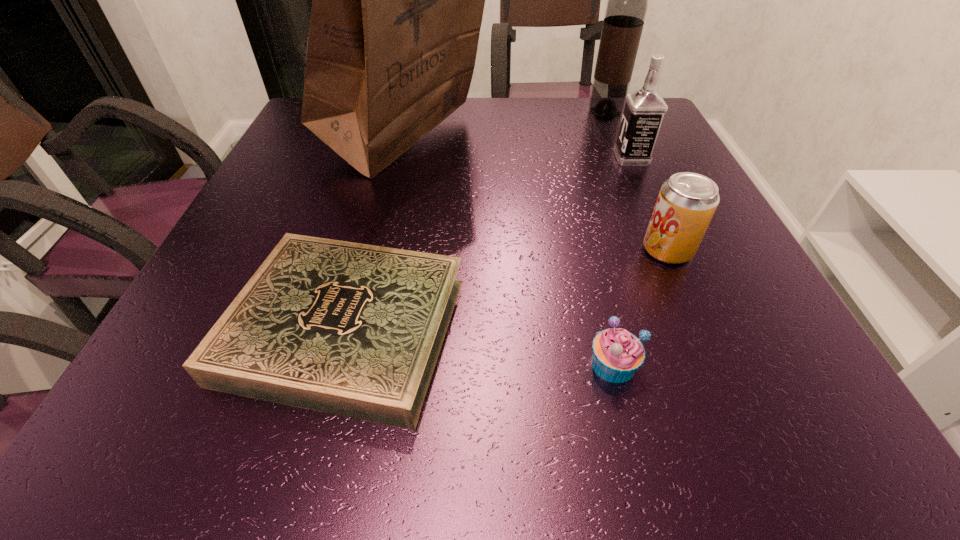
Where is `vacant space located on the front label of the vodka`? This screenshot has width=960, height=540. vacant space located on the front label of the vodka is located at coordinates (x=549, y=158).

Locate an element on the screen. free spot located 0.050m on the front label of the vodka is located at coordinates (595, 158).

I want to click on free point located on the left of the pop (soda), so click(x=537, y=250).

Where is `vacant space situated on the back of the third object from left to right`? vacant space situated on the back of the third object from left to right is located at coordinates (571, 192).

I want to click on vacant space located on the right of the hardback book, so click(x=656, y=329).

The image size is (960, 540). In order to click on grocery bag that is at the far edge in this screenshot , I will do `click(397, 0)`.

Where is `wine bottle present at the far edge`? wine bottle present at the far edge is located at coordinates (627, 4).

What are the coordinates of `object that is at the near edge` in the screenshot? It's located at (351, 329).

Image resolution: width=960 pixels, height=540 pixels. Find the location of `grocery bag located at the left edge`. grocery bag located at the left edge is located at coordinates (397, 0).

Find the location of a particular element. The height and width of the screenshot is (540, 960). hardback book that is at the left edge is located at coordinates pos(351,329).